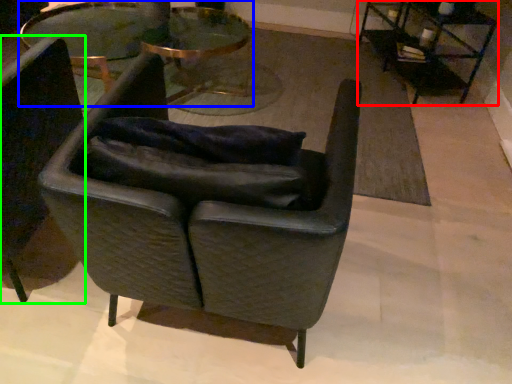
Question: Which object is the closest to the table (highlighted by a red box)? Choose among these: table (highlighted by a blue box) or chair (highlighted by a green box).

Choices:
 (A) table
 (B) chair

Answer: (A)